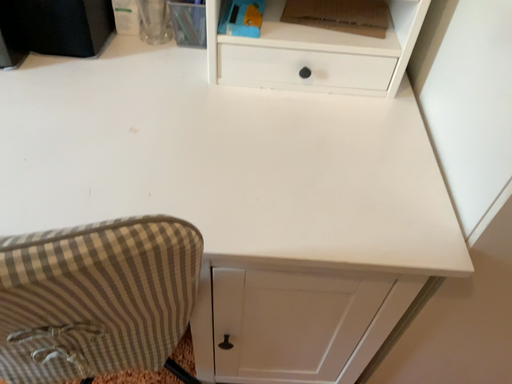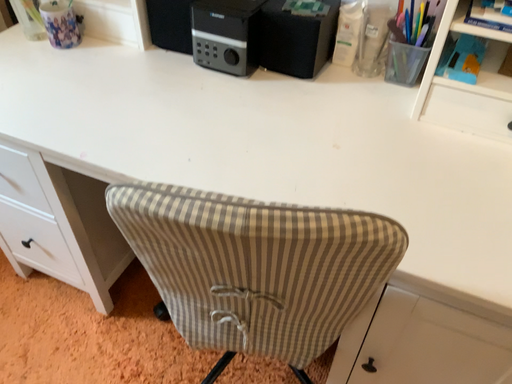
Question: How did the camera likely rotate when shooting the video?

Choices:
 (A) rotated right
 (B) rotated left

Answer: (B)